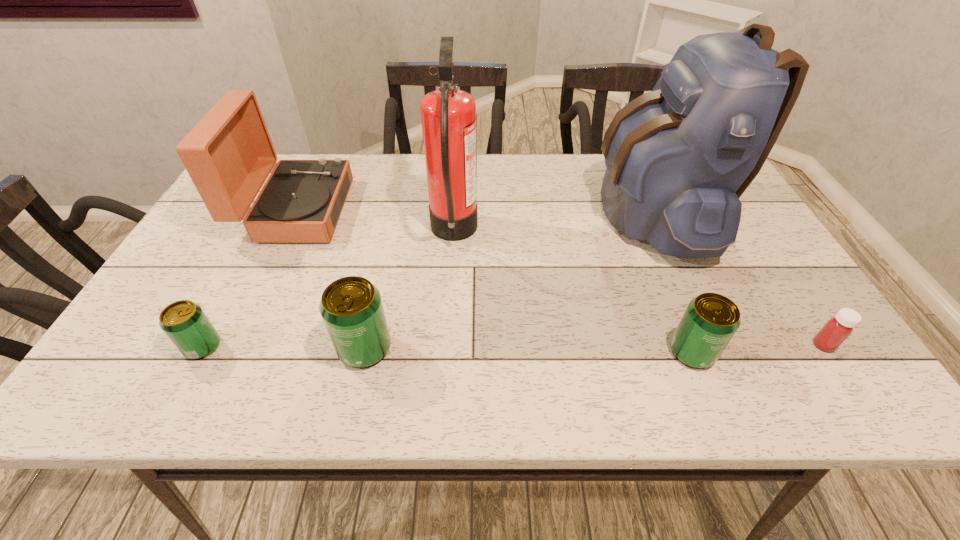
Image resolution: width=960 pixels, height=540 pixels. In the image, there is a desktop. What are the coordinates of `vacant area at the near edge` in the screenshot? It's located at (524, 327).

Image resolution: width=960 pixels, height=540 pixels. In order to click on vacant region at the right edge of the desktop in this screenshot , I will do `click(749, 294)`.

Where is `blank area at the near left corner`? blank area at the near left corner is located at coordinates (183, 359).

You are a GUI agent. You are given a task and a screenshot of the screen. Output one action in this format:
    pyautogui.click(x=<x>, y=<y>)
    Task: Click on the vacant region between the fifth object from right to left and the leftmost beer can
    The width and height of the screenshot is (960, 540).
    Given the screenshot: What is the action you would take?
    pyautogui.click(x=284, y=347)

I want to click on blank region between the second shortest beer can and the tallest beer can, so click(528, 350).

Find the location of `vacant point located between the rightmost beer can and the shortest beer can`. vacant point located between the rightmost beer can and the shortest beer can is located at coordinates (447, 349).

In order to click on unoccupied position between the backpack and the fourth object from right to left in this screenshot , I will do click(553, 222).

At what (x,y) coordinates should I click in order to perform the action: click on free point between the backpack and the leftmost beer can. Please return your answer as a coordinate pair (x, y). Looking at the image, I should click on (428, 279).

Find the location of a particular element. vacant point located between the shortest beer can and the medicine is located at coordinates (513, 346).

You are a GUI agent. You are given a task and a screenshot of the screen. Output one action in this format:
    pyautogui.click(x=<x>, y=<y>)
    Task: Click on the vacant region between the medicine and the second tallest beer can
    The height and width of the screenshot is (540, 960).
    Given the screenshot: What is the action you would take?
    pyautogui.click(x=757, y=348)